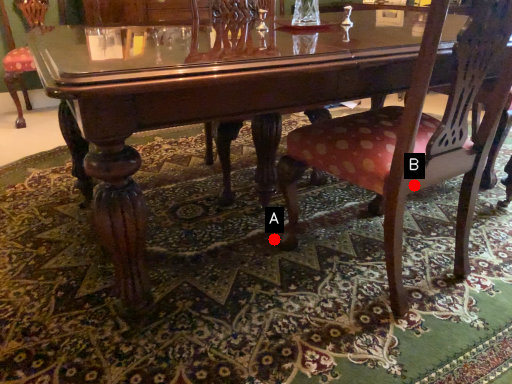
Question: Two points are circled on the image, labeled by A and B beside each circle. Which point is closer to the camera taking this photo?

Choices:
 (A) A is closer
 (B) B is closer

Answer: (B)